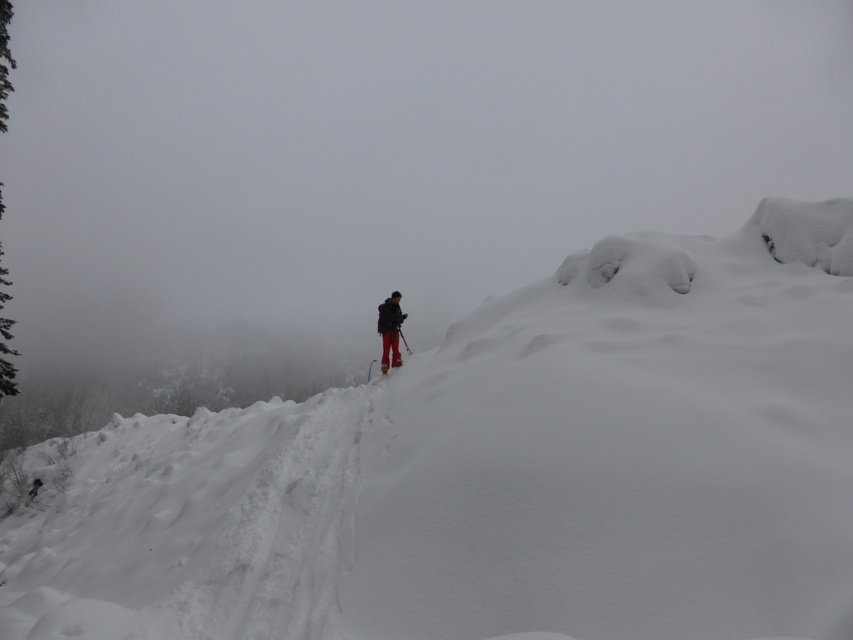
Does point (131, 620) lie in front of point (367, 369)?

Yes.

This screenshot has width=853, height=640. Identify the location of white fluffy snow at center. (502, 470).

Between point (381, 394) and point (399, 364), which one is positioned behind?

Point (399, 364)

The width and height of the screenshot is (853, 640). What are the coordinates of `white fluffy snow at center` in the screenshot? It's located at (502, 470).

Is dark matte jacket at center thinner than shiny metallic ski at center?

Correct, dark matte jacket at center's width is less than shiny metallic ski at center's.

Is point (392, 336) less distant than point (384, 371)?

No.

The height and width of the screenshot is (640, 853). What are the coordinates of `dark matte jacket at center` in the screenshot? It's located at (390, 330).

You are a GUI agent. You are given a task and a screenshot of the screen. Output one action in this format:
    pyautogui.click(x=<x>, y=<y>)
    Task: Click on the dark matte jacket at center
    
    Given the screenshot: What is the action you would take?
    pyautogui.click(x=390, y=330)

Who is lower down, white fluffy snow at center or dark matte jacket at center?

Positioned lower is white fluffy snow at center.

Does white fluffy snow at center lie in front of dark matte jacket at center?

Yes, white fluffy snow at center is closer to the viewer.

Identify the location of white fluffy snow at center. (502, 470).

Where is `white fluffy snow at center`? white fluffy snow at center is located at coordinates (502, 470).